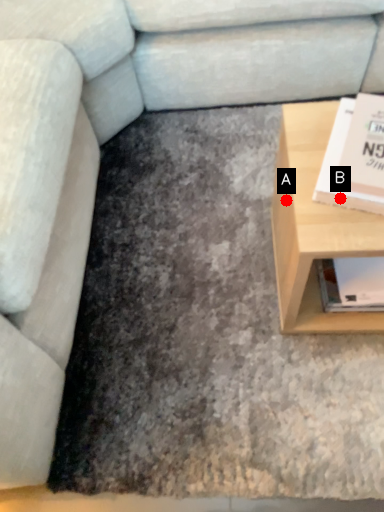
Question: Two points are circled on the image, labeled by A and B beside each circle. Which of the following is the farthest from the observer?

Choices:
 (A) A is further
 (B) B is further

Answer: (A)